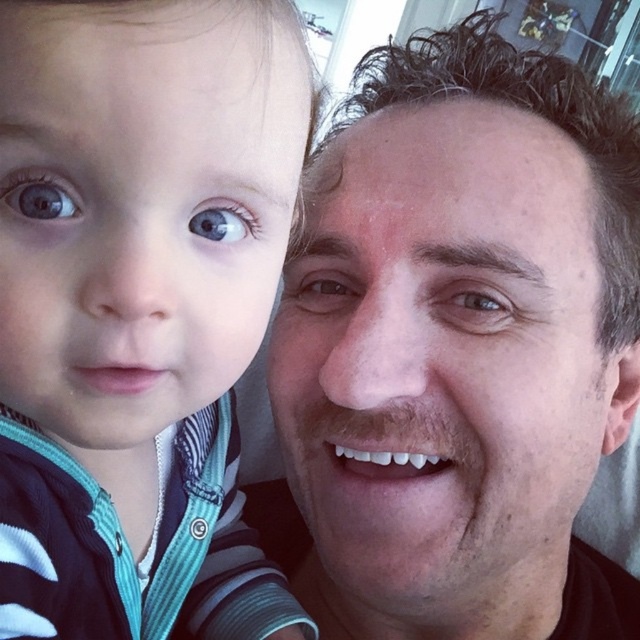
Question: Is smooth skin face at upper right to the right of striped fabric baby at left from the viewer's perspective?

Choices:
 (A) yes
 (B) no

Answer: (A)

Question: Does blue glossy eye at left have a smaller size compared to brown matte eye at center?

Choices:
 (A) yes
 (B) no

Answer: (A)

Question: Which object appears closest to the camera in this image?

Choices:
 (A) brown matte eye at center
 (B) smooth skin face at upper right
 (C) striped fabric baby at left
 (D) blue matte eye at center

Answer: (C)

Question: Which is farther from the striped fabric baby at left?

Choices:
 (A) smooth skin face at upper right
 (B) brown matte eye at center
 (C) blue matte eye at center
 (D) blue glossy eye at left

Answer: (C)

Question: Can you confirm if blue matte eye at center is positioned to the right of blue glossy eye at upper left?

Choices:
 (A) yes
 (B) no

Answer: (A)

Question: Which object appears farthest from the camera in this image?

Choices:
 (A) striped fabric baby at left
 (B) smooth skin face at upper right

Answer: (B)